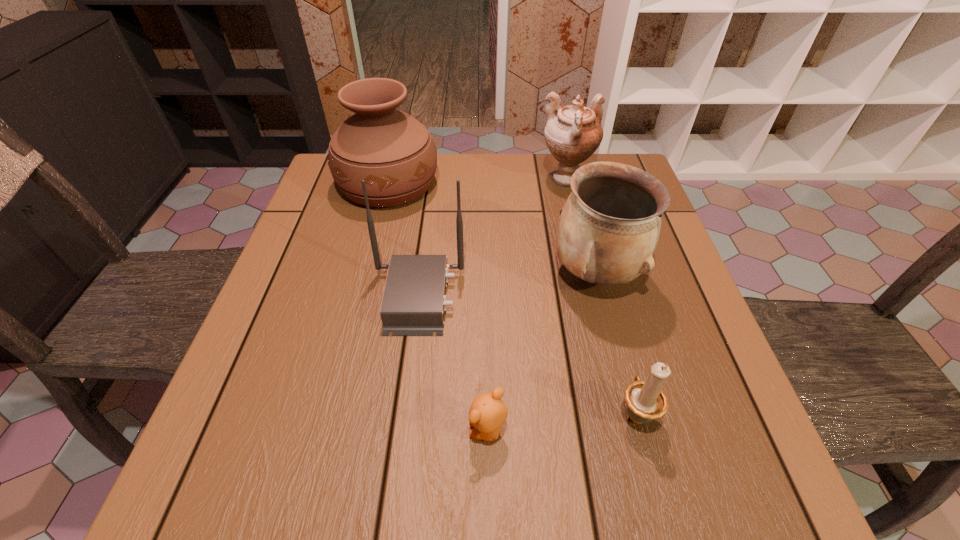
What are the coordinates of `vacant space located on the handle side of the fifth tallest object` in the screenshot? It's located at (614, 330).

Locate an element on the screen. vacant space located 0.350m on the handle side of the fifth tallest object is located at coordinates (594, 254).

Where is `vacant space located on the face of the shortest object`? The image size is (960, 540). vacant space located on the face of the shortest object is located at coordinates (291, 430).

I want to click on free region located 0.110m on the face of the shortest object, so click(x=401, y=430).

Where is `free space located on the face of the shortest object`? The image size is (960, 540). free space located on the face of the shortest object is located at coordinates (347, 430).

This screenshot has height=540, width=960. In order to click on object located in the left edge section of the desktop in this screenshot , I will do `click(394, 153)`.

Where is `candle_holder at the right edge`? The width and height of the screenshot is (960, 540). candle_holder at the right edge is located at coordinates (646, 401).

Locate an element on the screen. object situated at the far left corner is located at coordinates (394, 153).

In order to click on object present at the far right corner in this screenshot , I will do `click(573, 133)`.

Identify the location of vacant space at the far edge of the desktop. (475, 173).